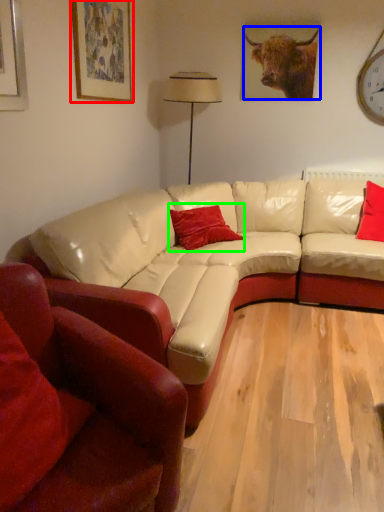
Question: Estimate the real-world distances between objects in this image. Which object is closer to picture frame (highlighted by a red box), bull (highlighted by a blue box) or pillow (highlighted by a green box)?

Choices:
 (A) bull
 (B) pillow

Answer: (B)